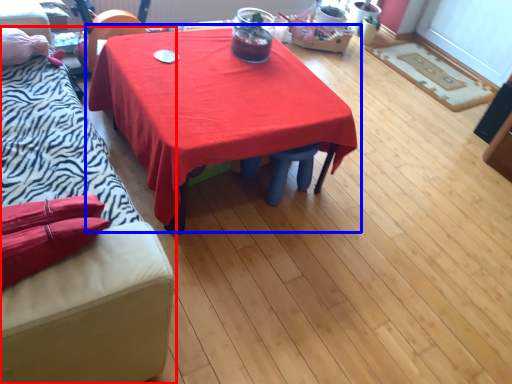
Question: Which object appears closest to the camera in this image, studio couch (highlighted by a red box) or table (highlighted by a blue box)?

Choices:
 (A) studio couch
 (B) table

Answer: (A)